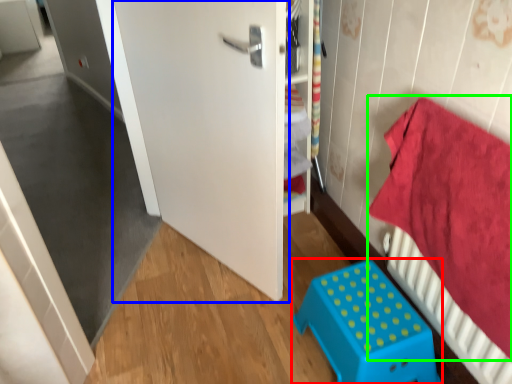
Question: Which is farther away from furniture (highlighted by a red box)? door (highlighted by a blue box) or bedding (highlighted by a green box)?

Choices:
 (A) door
 (B) bedding

Answer: (A)